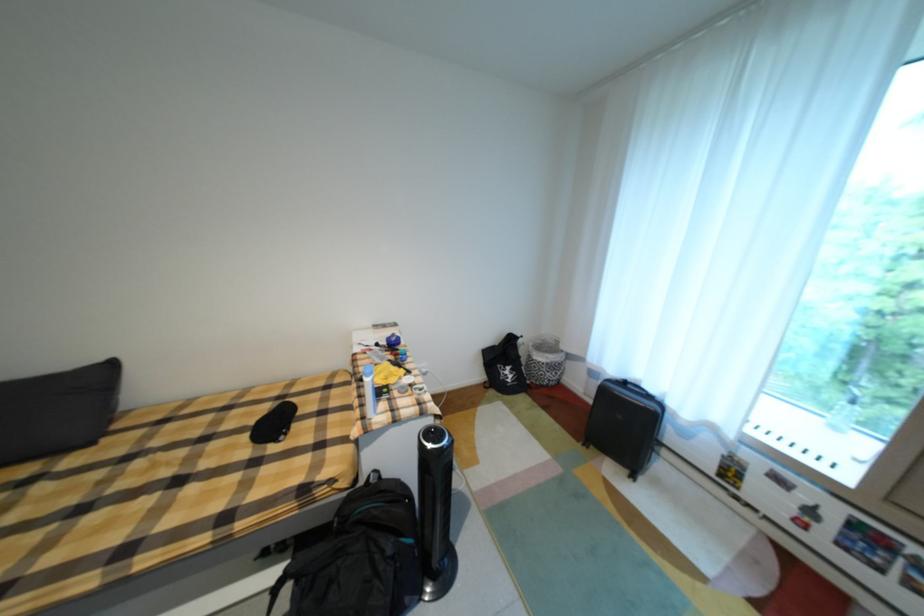
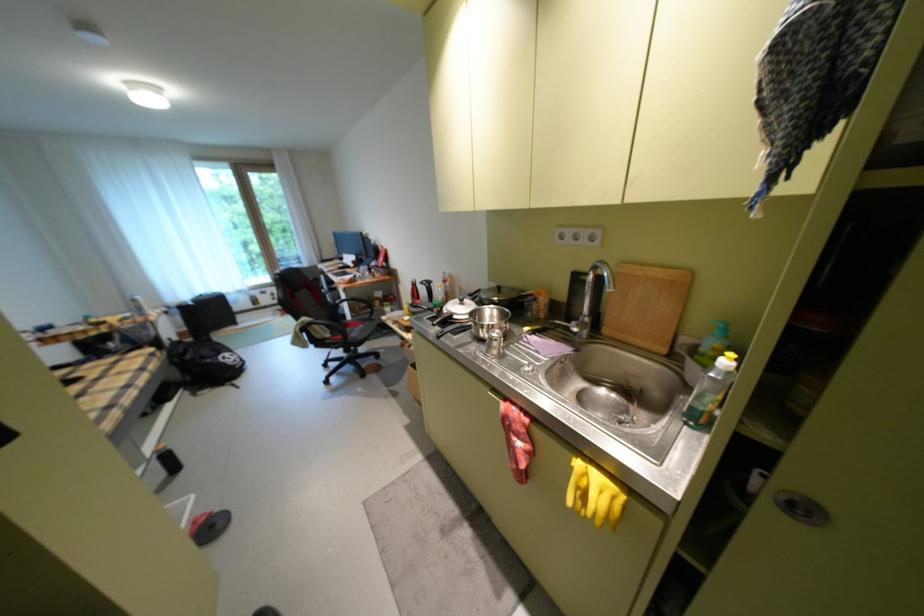
Where in the second image is the point corresponding to [811,499] from the first image?

(280, 294)